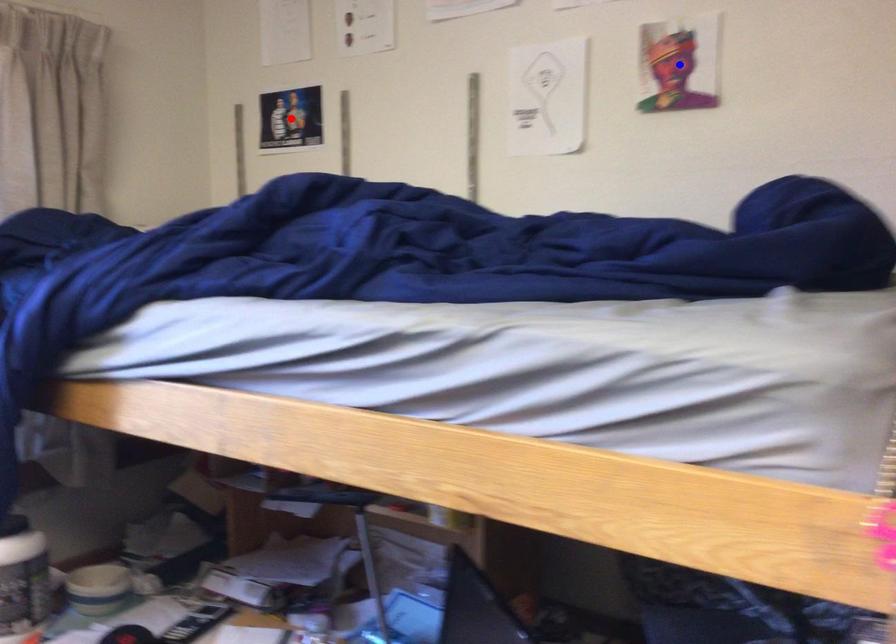
Question: Which of the two points in the image is closer to the camera?

Choices:
 (A) Blue point is closer.
 (B) Red point is closer.

Answer: (A)